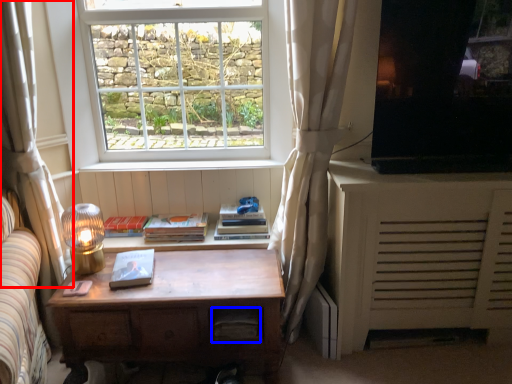
Question: Which object is closer to the camera taking this photo, curtain (highlighted by a red box) or drawer (highlighted by a blue box)?

Choices:
 (A) curtain
 (B) drawer

Answer: (A)